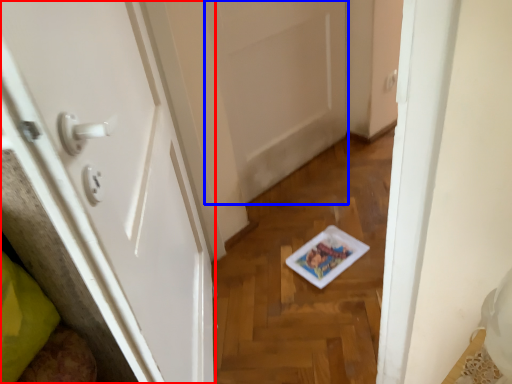
Question: Which point is closer to the camera, door (highlighted by a red box) or door (highlighted by a blue box)?

Choices:
 (A) door
 (B) door

Answer: (A)